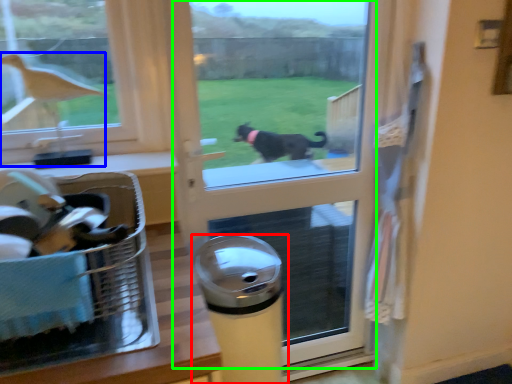
Question: Which object is positioned farthest from waste container (highlighted by a red box)? Select from bird (highlighted by a blue box) and screen door (highlighted by a green box).

Choices:
 (A) bird
 (B) screen door

Answer: (B)